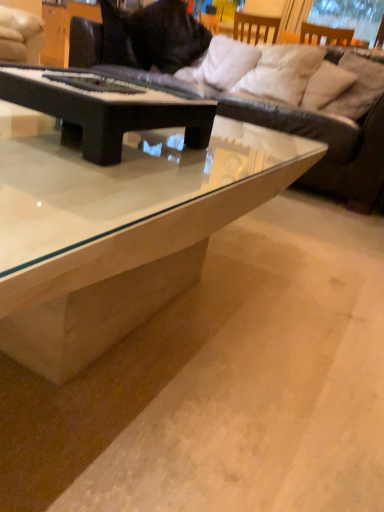
Question: Does black matte piano at center, which is the 1th coffee table from back to front, turn towards beige fabric pillow at upper right, which is the first pillow from right to left?

Choices:
 (A) yes
 (B) no

Answer: (B)

Question: From a real-world perspective, is black matte piano at center, which is the 1th coffee table from back to front, positioned over beige fabric pillow at upper right, which is the first pillow from right to left, based on gravity?

Choices:
 (A) yes
 (B) no

Answer: (B)

Question: Can you confirm if black matte piano at center, which is the 1th coffee table from back to front, is smaller than beige fabric pillow at upper right, which appears as the 4th pillow when viewed from the left?

Choices:
 (A) yes
 (B) no

Answer: (A)

Question: Is black matte piano at center, which is the 1th coffee table from back to front, behind beige fabric pillow at upper right, which is the first pillow from right to left?

Choices:
 (A) no
 (B) yes

Answer: (A)

Question: Can you confirm if black matte piano at center, which appears as the 2th coffee table when viewed from the front, is taller than beige fabric pillow at upper right, which appears as the 4th pillow when viewed from the left?

Choices:
 (A) no
 (B) yes

Answer: (A)

Question: From their relative heights in the image, would you say beige fabric pillow at upper right, which appears as the 4th pillow when viewed from the left, is taller or shorter than black leather couch at upper center?

Choices:
 (A) tall
 (B) short

Answer: (B)

Question: From the image's perspective, is beige fabric pillow at upper right, which appears as the 4th pillow when viewed from the left, above or below black leather couch at upper center?

Choices:
 (A) below
 (B) above

Answer: (A)

Question: Relative to black leather couch at upper center, is beige fabric pillow at upper right, which is the first pillow from right to left, in front or behind?

Choices:
 (A) behind
 (B) front

Answer: (A)

Question: From a real-world perspective, is beige fabric pillow at upper right, which is the first pillow from right to left, positioned above or below black leather couch at upper center?

Choices:
 (A) below
 (B) above

Answer: (B)

Question: From the image's perspective, relative to transparent glass coffee table at center, the second coffee table in the back-to-front sequence, is beige fabric pillow at upper right, which appears as the 4th pillow when viewed from the left, above or below?

Choices:
 (A) below
 (B) above

Answer: (B)

Question: Considering the positions of beige fabric pillow at upper right, which is the first pillow from right to left, and transparent glass coffee table at center, which is the first coffee table in front-to-back order, in the image, is beige fabric pillow at upper right, which is the first pillow from right to left, bigger or smaller than transparent glass coffee table at center, which is the first coffee table in front-to-back order,?

Choices:
 (A) big
 (B) small

Answer: (B)

Question: Is beige fabric pillow at upper right, which is the first pillow from right to left, inside the boundaries of transparent glass coffee table at center, which is the first coffee table in front-to-back order, or outside?

Choices:
 (A) outside
 (B) inside

Answer: (A)

Question: Considering the positions of beige fabric pillow at upper right, which appears as the 4th pillow when viewed from the left, and transparent glass coffee table at center, the second coffee table in the back-to-front sequence, in the image, is beige fabric pillow at upper right, which appears as the 4th pillow when viewed from the left, taller or shorter than transparent glass coffee table at center, the second coffee table in the back-to-front sequence,?

Choices:
 (A) short
 (B) tall

Answer: (A)

Question: Relative to white soft pillow at upper right, marked as the third pillow in a right-to-left arrangement, is transparent glass coffee table at center, the second coffee table in the back-to-front sequence, in front or behind?

Choices:
 (A) behind
 (B) front

Answer: (B)

Question: Considering the positions of transparent glass coffee table at center, the second coffee table in the back-to-front sequence, and white soft pillow at upper right, marked as the third pillow in a right-to-left arrangement, in the image, is transparent glass coffee table at center, the second coffee table in the back-to-front sequence, taller or shorter than white soft pillow at upper right, marked as the third pillow in a right-to-left arrangement,?

Choices:
 (A) tall
 (B) short

Answer: (A)